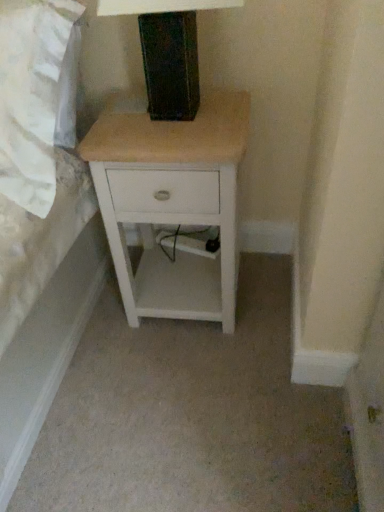
Image resolution: width=384 pixels, height=512 pixels. Identify the location of white wood nightstand at center. (172, 204).

The height and width of the screenshot is (512, 384). What do you see at coordinates (172, 204) in the screenshot? I see `white wood nightstand at center` at bounding box center [172, 204].

Measure the distance between point (x=175, y=188) and camera.

3.45 feet.

You are a GUI agent. You are given a task and a screenshot of the screen. Output one action in this format:
    pyautogui.click(x=<x>, y=<y>)
    Task: Click on the white wood nightstand at center
    The height and width of the screenshot is (512, 384).
    Given the screenshot: What is the action you would take?
    pyautogui.click(x=172, y=204)